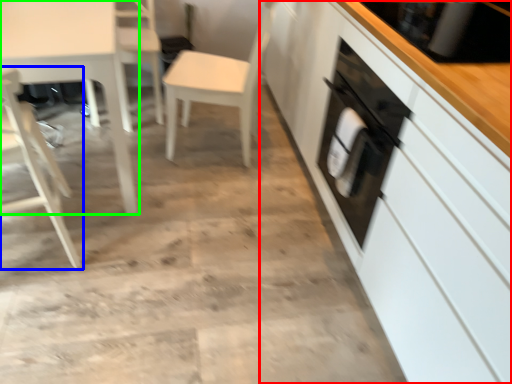
Question: Which is nearer to the cabinetry (highlighted by a red box)? chair (highlighted by a blue box) or table (highlighted by a green box).

Choices:
 (A) chair
 (B) table

Answer: (B)